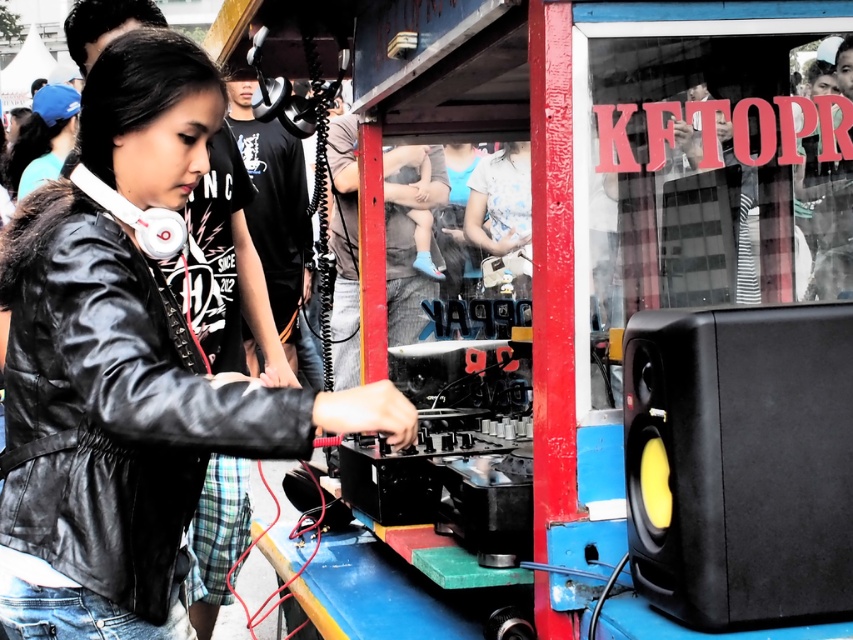
Where is the black leather jacket at center located in the image?

The black leather jacket at center is located at point [126,369] in the image.

You are a photographer trying to capture a photo of the DJ setup. You need to position yourself so that both the black leather jacket at center and the black matte speaker at lower right are visible in the frame. Based on their positions, which side of the DJ setup should you stand to ensure both objects are in the shot?

To capture both the black leather jacket at center and the black matte speaker at lower right, you should position yourself to the left side of the DJ setup. Since the black leather jacket at center is to the left of the black matte speaker at lower right, standing on the left side ensures both objects are within the frame.